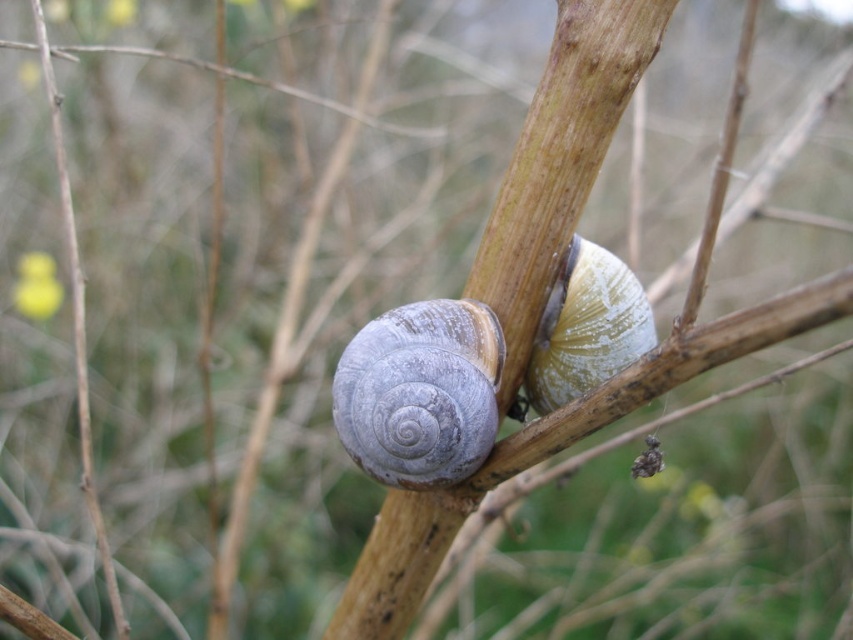
Based on the coordinates provided in the scene description, where exactly is the gray matte snail at center located?

The gray matte snail at center is located at point (x=421, y=392).